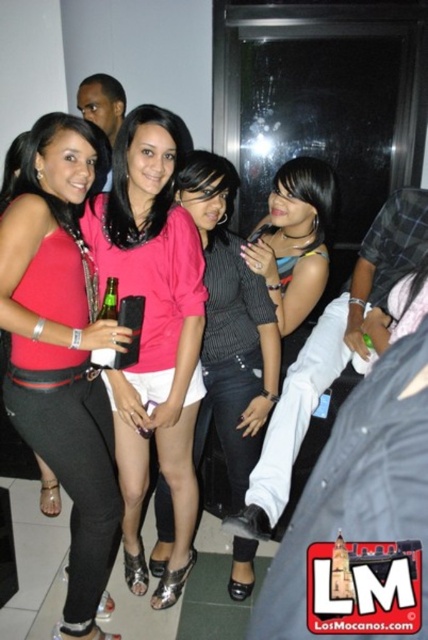
You are at a party and see two pink tops at the center of the image. Which one is taller, the pink satin blouse at center or the pink matte shirt at center?

The pink satin blouse at center is much taller as the pink matte shirt at center.

Based on the photo, you are a photographer trying to capture a group photo of the two people in the image. The camera you are using has a minimum focusing distance of 12 inches between subjects. Can you take a clear photo of both the pink matte shirt at center and the multicolored striped shirt at center without blurring either of them?

The distance between the pink matte shirt at center and the multicolored striped shirt at center is 12.83 inches, which is just over the camera minimum focusing distance of 12 inches. Therefore, you can take a clear photo of both without blurring.

You are a photographer at the event and want to ensure both the matte pink blouse at center and the multicolored striped shirt at center are visible in your photo. Given their sizes, which one might you need to adjust your camera angle to focus on more?

The matte pink blouse at center is larger in size than the multicolored striped shirt at center, so you may need to adjust your camera angle to focus more on the multicolored striped shirt at center to ensure both are visible.